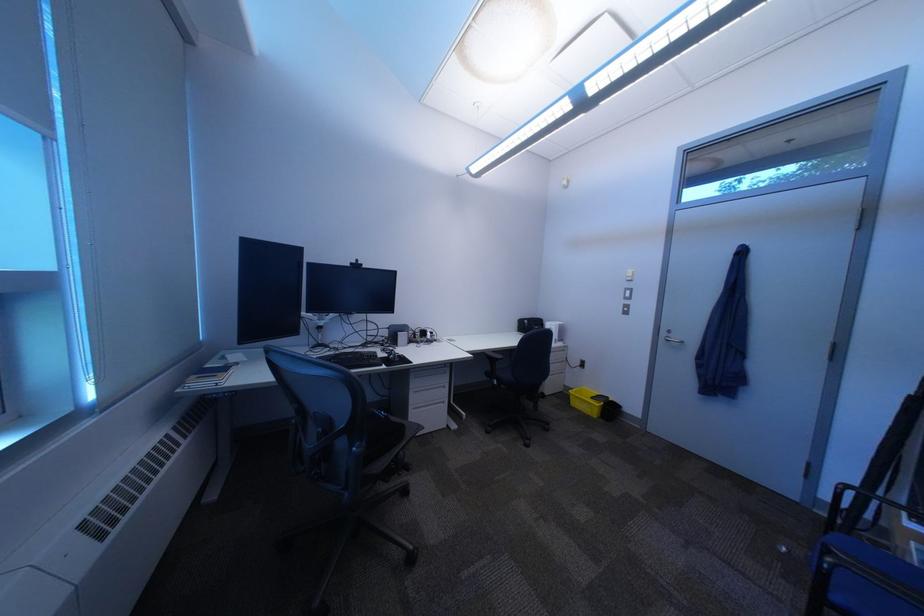
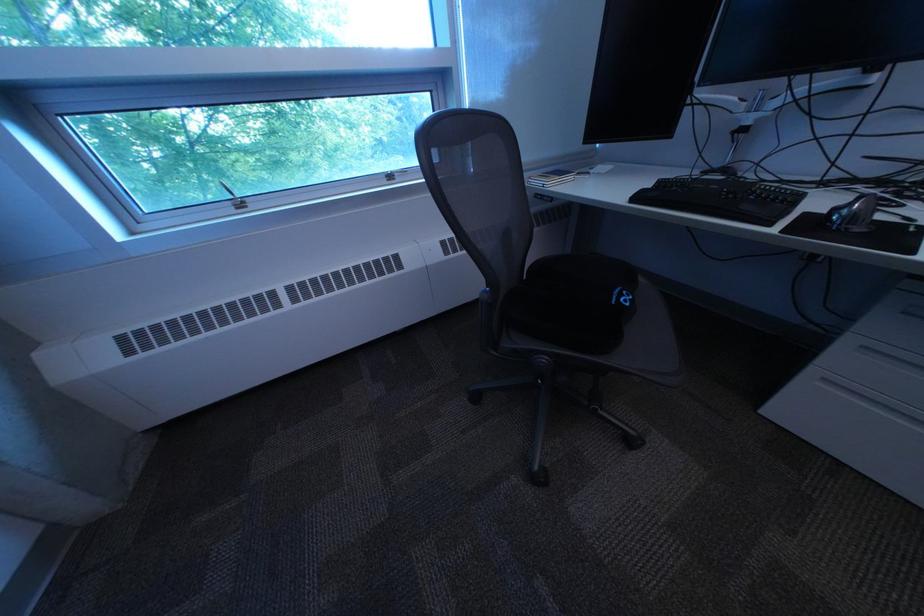
Based on the continuous images, in which direction is the camera rotating?

The rotation direction of the camera is left-down.